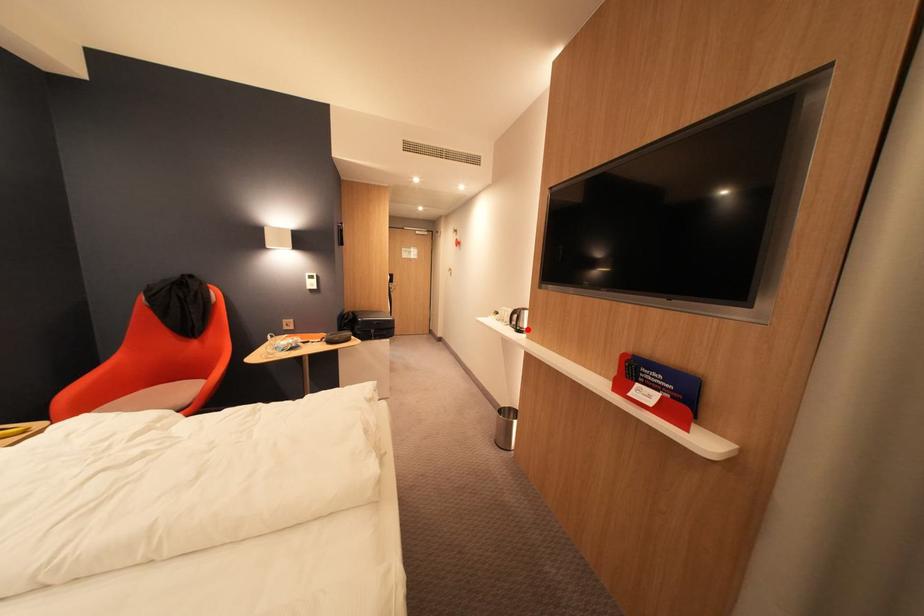
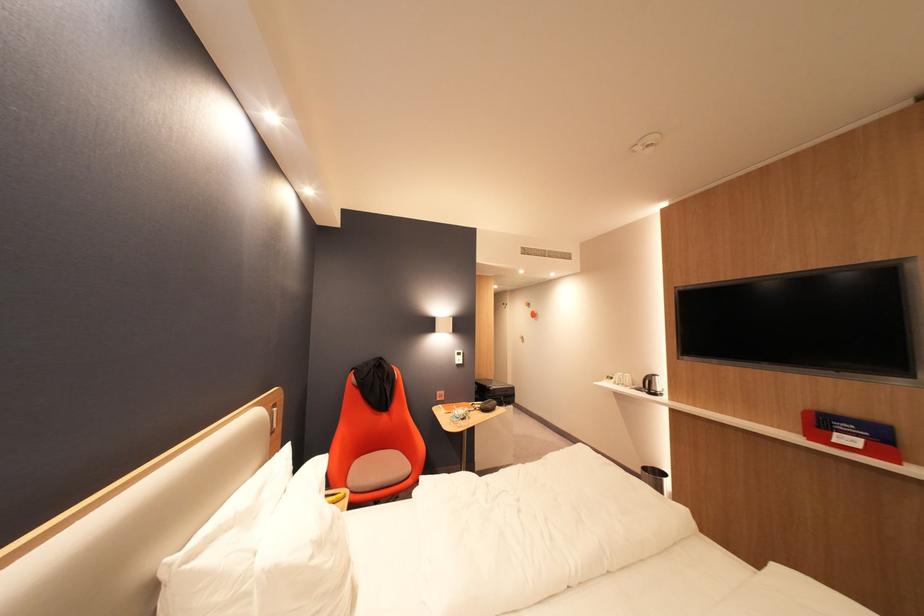
Where in the second image is the point corresponding to the highlighted location from the first image?

(662, 392)